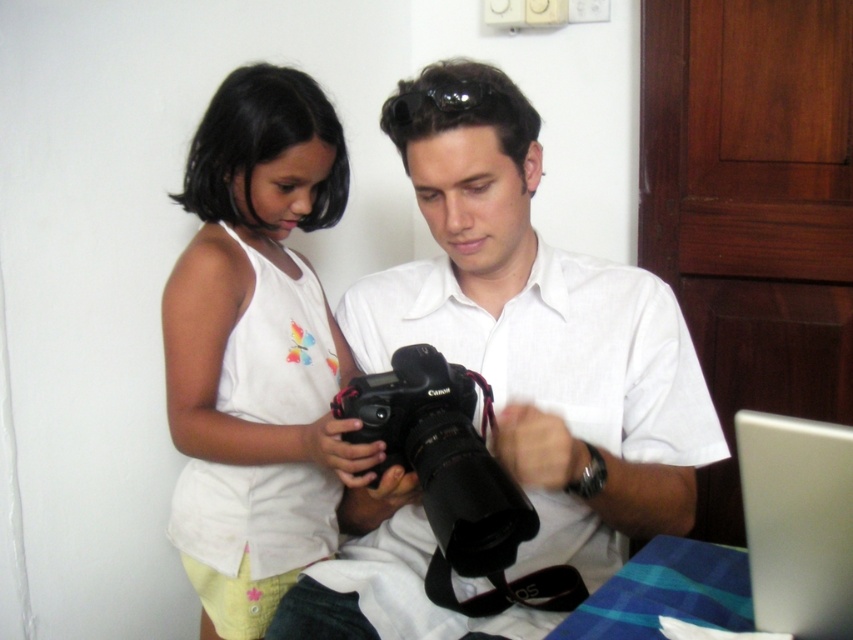
Which is more to the right, matte black camera at center or white cotton tank top at upper left?

matte black camera at center is more to the right.

The height and width of the screenshot is (640, 853). Describe the element at coordinates (538, 328) in the screenshot. I see `matte black camera at center` at that location.

Is point (605, 502) farther from viewer compared to point (294, 384)?

No, it is in front of (294, 384).

This screenshot has width=853, height=640. In order to click on matte black camera at center in this screenshot , I will do `click(538, 328)`.

Measure the distance between white cotton tank top at upper left and white glossy laptop at lower right.

A distance of 25.15 inches exists between white cotton tank top at upper left and white glossy laptop at lower right.

What do you see at coordinates (256, 349) in the screenshot? This screenshot has height=640, width=853. I see `white cotton tank top at upper left` at bounding box center [256, 349].

What do you see at coordinates (256, 349) in the screenshot? I see `white cotton tank top at upper left` at bounding box center [256, 349].

The image size is (853, 640). What are the coordinates of `white cotton tank top at upper left` in the screenshot? It's located at (256, 349).

Can you confirm if matte black camera at center is thinner than black matte camera at center?

No.

Between matte black camera at center and black matte camera at center, which one has more height?

matte black camera at center is taller.

Does point (546, 385) come closer to viewer compared to point (358, 392)?

That is False.

What are the coordinates of `matte black camera at center` in the screenshot? It's located at (538, 328).